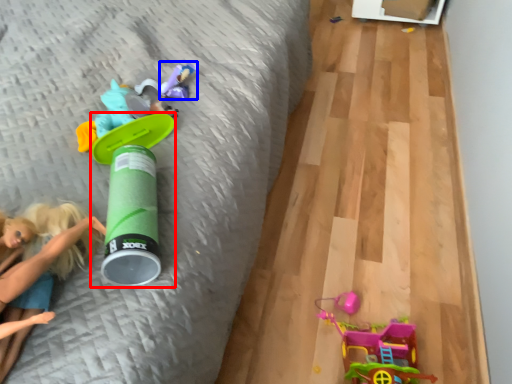
Question: Which of the following is the closest to the observer, toy (highlighted by a red box) or toy (highlighted by a blue box)?

Choices:
 (A) toy
 (B) toy

Answer: (A)